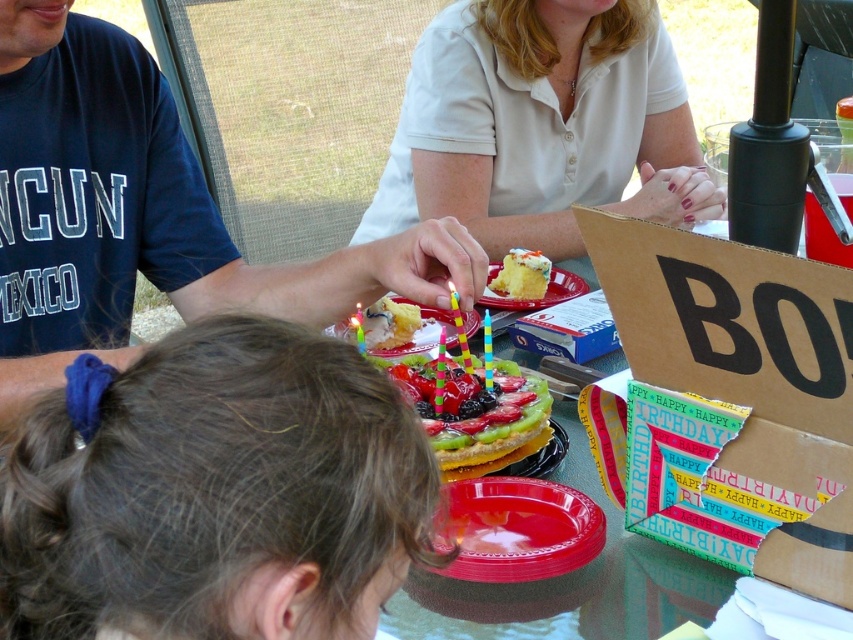
Does yellow sponge cake at center come behind multicolored plastic birthday candle at center?

Yes.

Is point (527, 278) positioned in front of point (463, 330)?

No, it is not.

Is point (543, 257) closer to camera compared to point (471, 364)?

No, (543, 257) is further to viewer.

Locate an element on the screen. yellow sponge cake at center is located at coordinates (521, 275).

Is white cotton shirt at upper center thinner than multicolored plastic birthday candle at center?

No.

Can you confirm if white cotton shirt at upper center is shorter than multicolored plastic birthday candle at center?

Incorrect, white cotton shirt at upper center's height does not fall short of multicolored plastic birthday candle at center's.

Between point (480, 236) and point (463, 353), which one is positioned in front?

Point (463, 353) is more forward.

The width and height of the screenshot is (853, 640). I want to click on white cotton shirt at upper center, so click(x=538, y=132).

This screenshot has width=853, height=640. What do you see at coordinates (213, 492) in the screenshot?
I see `brown hair at center` at bounding box center [213, 492].

Can you confirm if brown hair at center is wider than multicolored plastic candle at center?

Indeed, brown hair at center has a greater width compared to multicolored plastic candle at center.

Is point (343, 397) in front of point (440, 360)?

Yes.

You are a GUI agent. You are given a task and a screenshot of the screen. Output one action in this format:
    pyautogui.click(x=<x>, y=<y>)
    Task: Click on the brown hair at center
    The height and width of the screenshot is (640, 853).
    Given the screenshot: What is the action you would take?
    pyautogui.click(x=213, y=492)